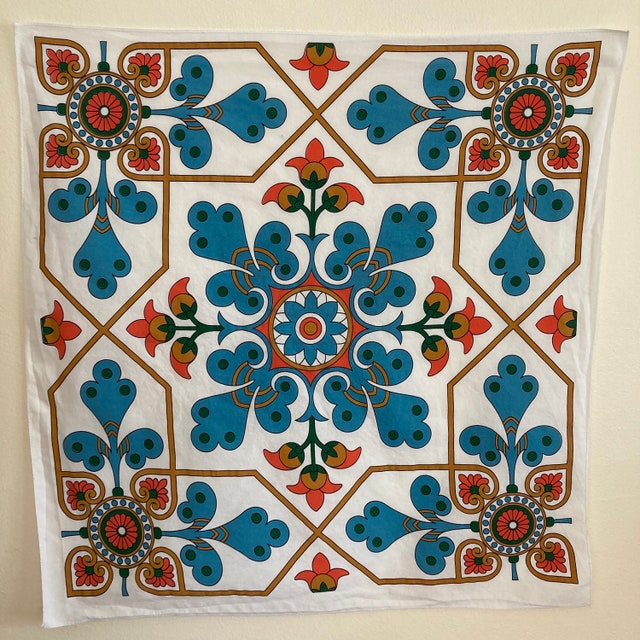
Identify the location of tapestry. (488, 480).